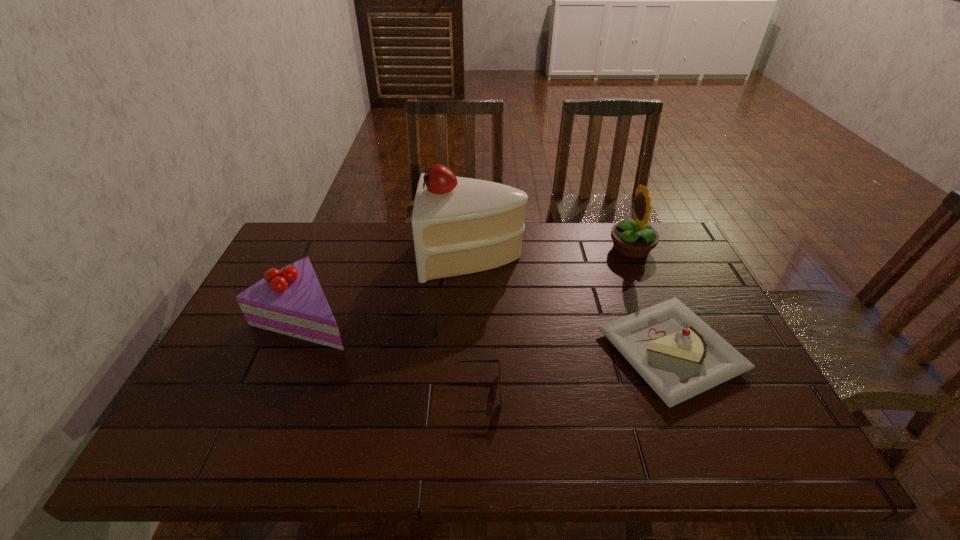
The image size is (960, 540). I want to click on blank area located on the face of the fourth shortest object, so click(593, 248).

The width and height of the screenshot is (960, 540). Identify the location of vacant space located on the face of the fourth shortest object. (516, 248).

Where is `blank area located on the front of the third tallest object`? blank area located on the front of the third tallest object is located at coordinates (248, 453).

Find the location of a particular element. The width and height of the screenshot is (960, 540). vacant space positioned 0.380m on the back of the fourth tallest object is located at coordinates (619, 226).

I want to click on vacant space located 0.240m on the front-facing side of the sunglasses, so click(604, 392).

Find the location of a particular element. The height and width of the screenshot is (540, 960). cake at the far edge is located at coordinates (460, 225).

In order to click on sunflower that is at the far edge in this screenshot , I will do `click(632, 239)`.

At what (x,y) coordinates should I click in order to perform the action: click on object that is at the left edge. Please return your answer as a coordinate pair (x, y). Image resolution: width=960 pixels, height=540 pixels. Looking at the image, I should click on (290, 301).

At what (x,y) coordinates should I click in order to perform the action: click on sunflower that is at the right edge. Please return your answer as a coordinate pair (x, y). The height and width of the screenshot is (540, 960). Looking at the image, I should click on (632, 239).

In order to click on cake at the right edge in this screenshot , I will do 679,356.